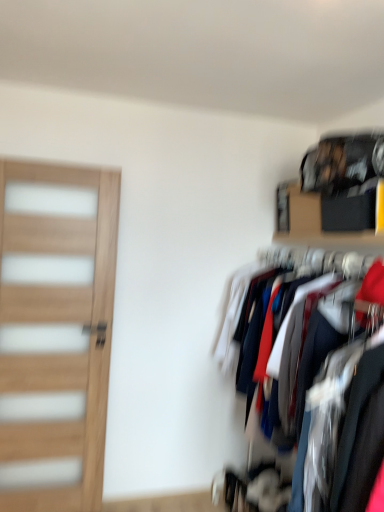
Question: In the image, is wooden shelf at upper right on the left side or the right side of wooden door at left?

Choices:
 (A) right
 (B) left

Answer: (A)

Question: Relative to wooden door at left, is wooden shelf at upper right in front or behind?

Choices:
 (A) front
 (B) behind

Answer: (A)

Question: From a real-world perspective, is wooden shelf at upper right physically located above or below wooden door at left?

Choices:
 (A) above
 (B) below

Answer: (A)

Question: From the image's perspective, is wooden door at left located above or below wooden shelf at upper right?

Choices:
 (A) below
 (B) above

Answer: (A)

Question: Is wooden door at left bigger or smaller than wooden shelf at upper right?

Choices:
 (A) big
 (B) small

Answer: (A)

Question: From a real-world perspective, is wooden door at left physically located above or below wooden shelf at upper right?

Choices:
 (A) below
 (B) above

Answer: (A)

Question: In the image, is wooden door at left positioned in front of or behind wooden shelf at upper right?

Choices:
 (A) front
 (B) behind

Answer: (B)